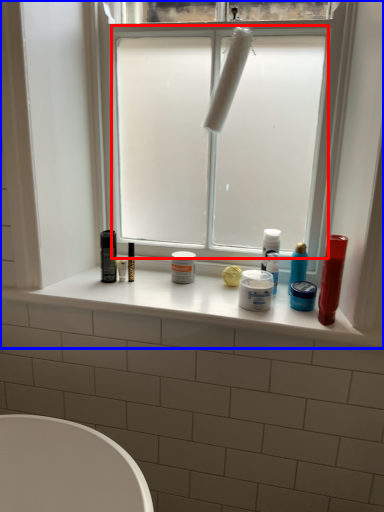
Question: Which object appears closest to the camera in this image, window screen (highlighted by a red box) or window (highlighted by a blue box)?

Choices:
 (A) window screen
 (B) window

Answer: (B)